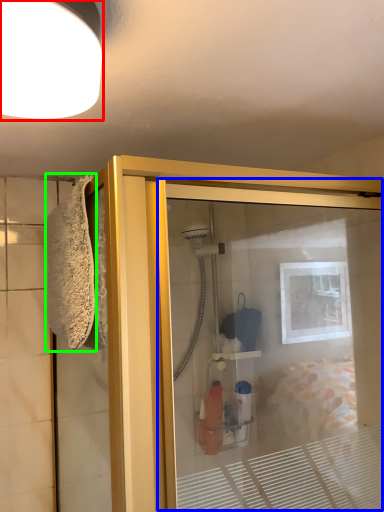
Question: Based on their relative distances, which object is farther from light fixture (highlighted by a red box)? Choose from screen door (highlighted by a blue box) and bath towel (highlighted by a green box).

Choices:
 (A) screen door
 (B) bath towel

Answer: (A)